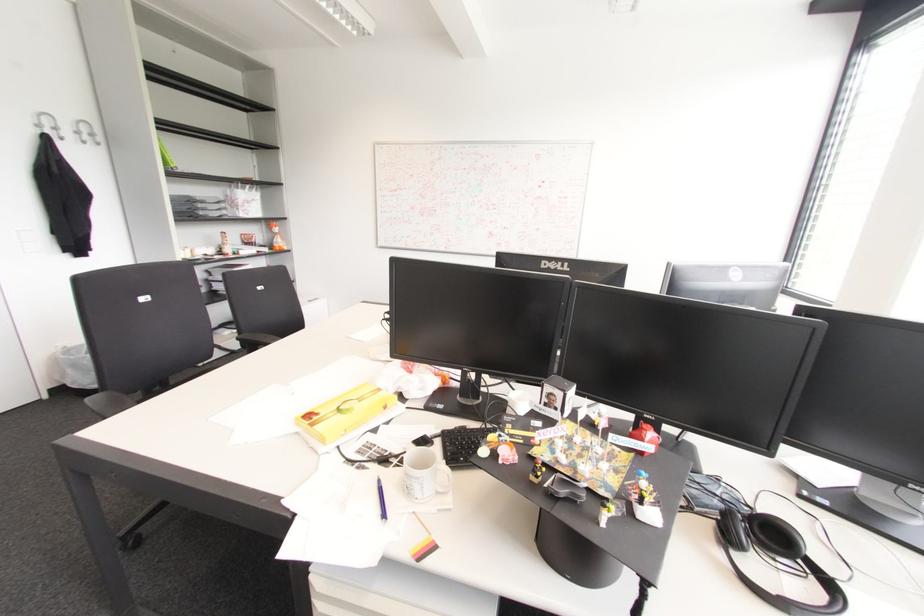
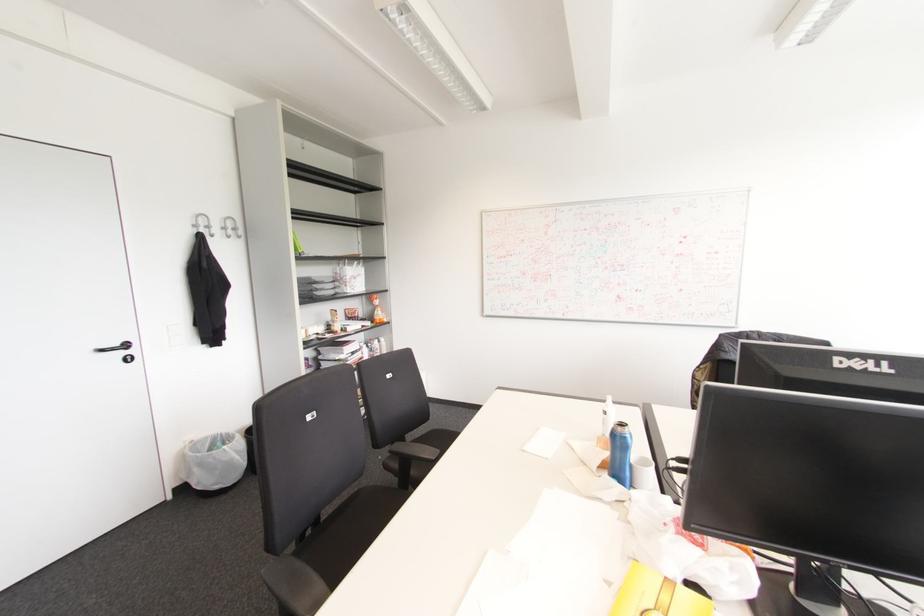
In the second image, find the point that corresponds to the point at 91,135 in the first image.

(234, 229)